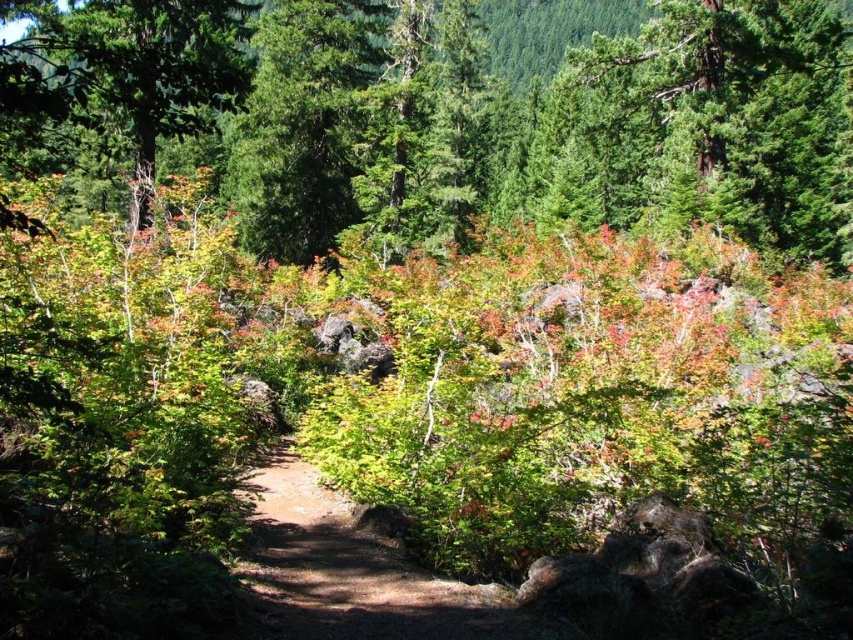
You are a hiker trying to navigate the narrow dirt path at center. There is a green matte tree at upper center nearby. Do you think the tree is wider than the path?

The green matte tree at upper center might be wider than dirt path at center, so there is a possibility that the tree is wider than the path. Proceed with caution.

You are standing at the point marked by point (498, 118) in the forest scene. What type of tree are you facing?

The point (498, 118) marks a green matte tree at upper center, so you are facing a green matte tree.

You are hiking along the dirt path at center and want to take a photo of the green matte tree at upper left. In which direction should you face to capture the tree in your camera?

To capture the green matte tree at upper left in your photo, you should face to the left since the green matte tree at upper left is positioned to the left of the dirt path at center where you are standing.